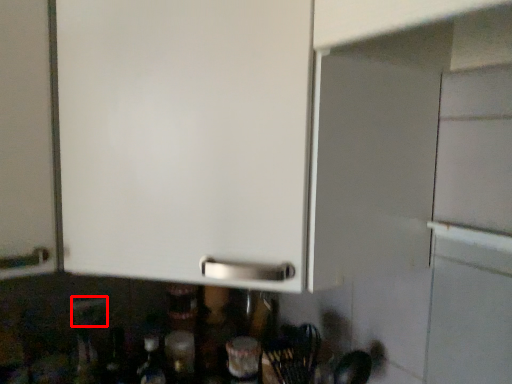
Question: From the image's perspective, where is electric outlet (annotated by the red box) located in relation to bottle in the image?

Choices:
 (A) below
 (B) above

Answer: (B)